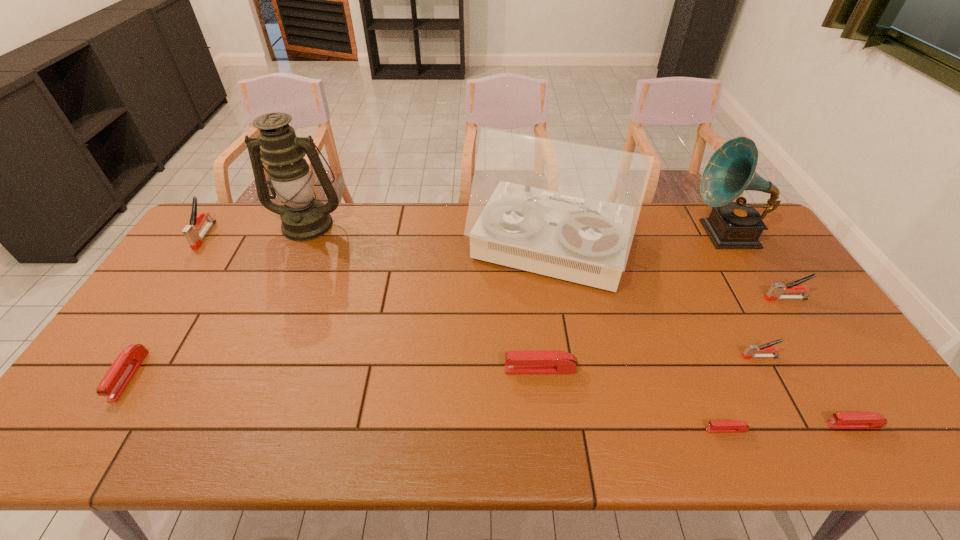
Identify the location of record player at the far edge. (566, 210).

Locate an element on the screen. phonograph_record at the far edge is located at coordinates (731, 170).

This screenshot has width=960, height=540. What are the coordinates of `stapler located at the far edge` in the screenshot? It's located at (190, 232).

The height and width of the screenshot is (540, 960). I want to click on phonograph_record that is positioned at the right edge, so click(731, 170).

You are a GUI agent. You are given a task and a screenshot of the screen. Output one action in this format:
    pyautogui.click(x=<x>, y=<y>)
    Task: Click on the object that is at the far left corner
    This screenshot has width=960, height=540.
    Given the screenshot: What is the action you would take?
    pyautogui.click(x=190, y=232)

At what (x,y) coordinates should I click in order to perform the action: click on object that is at the far right corner. Please return your answer as a coordinate pair (x, y). Image resolution: width=960 pixels, height=540 pixels. Looking at the image, I should click on (731, 170).

This screenshot has width=960, height=540. I want to click on object that is positioned at the near right corner, so click(x=842, y=420).

You are a GUI agent. You are given a task and a screenshot of the screen. Output one action in this format:
    pyautogui.click(x=<x>, y=<y>)
    Task: Click on the vacant area at the far edge
    The width and height of the screenshot is (960, 540).
    Given the screenshot: What is the action you would take?
    pyautogui.click(x=642, y=236)

This screenshot has width=960, height=540. In order to click on vacant region at the left edge of the desktop in this screenshot , I will do `click(198, 263)`.

I want to click on blank area at the right edge, so click(x=804, y=386).